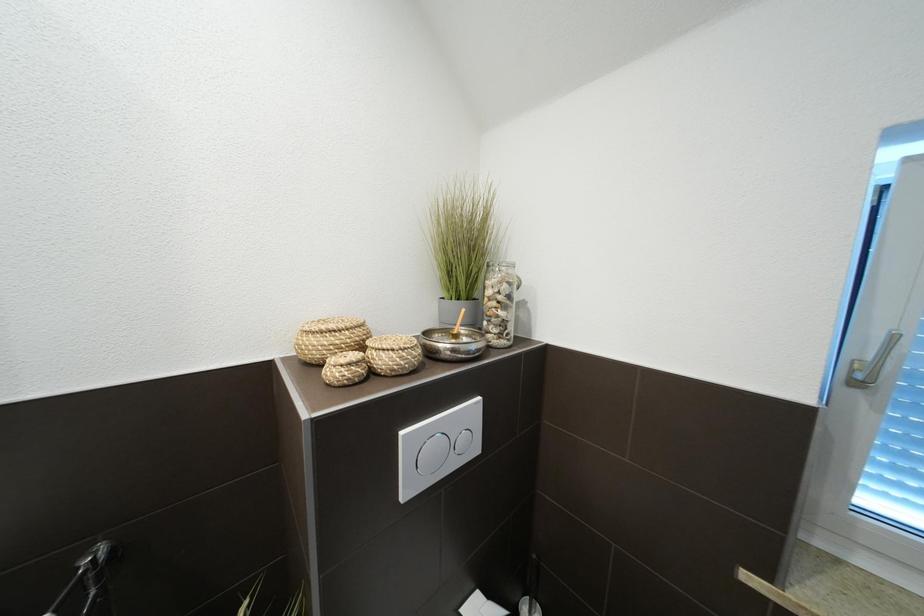
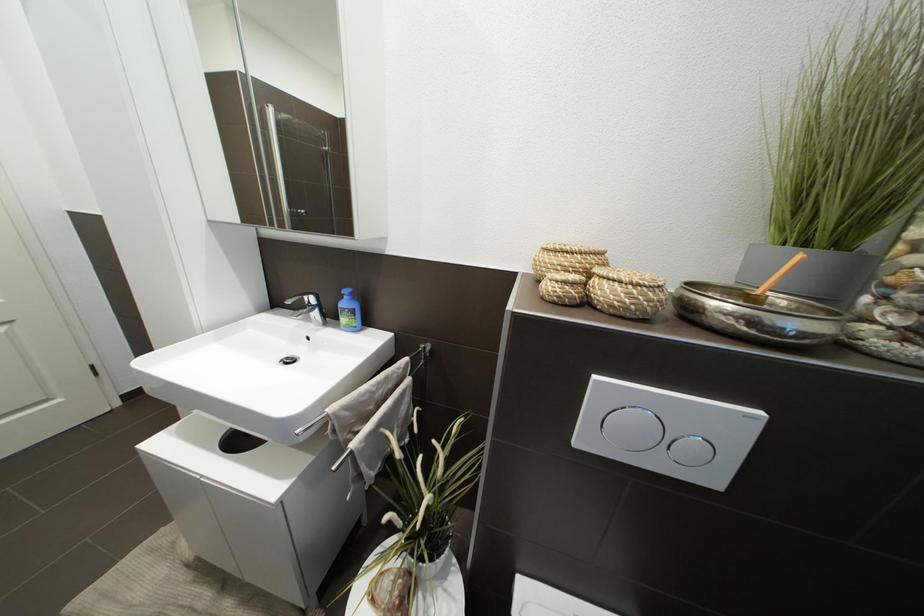
Question: The images are taken continuously from a first-person perspective. In which direction is your viewpoint rotating?

Choices:
 (A) Left
 (B) Right
 (C) Up
 (D) Down

Answer: (A)